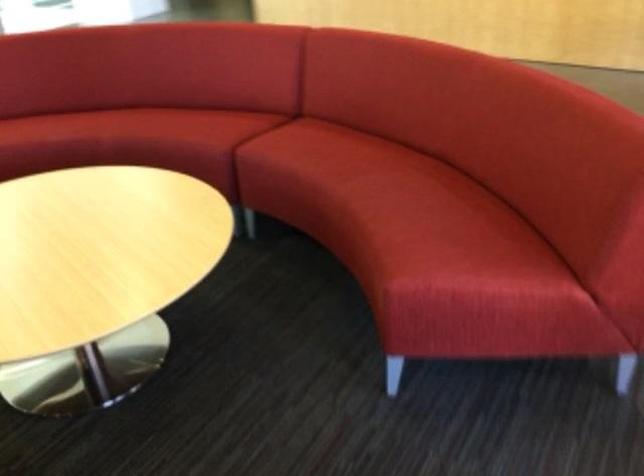
Find where to sit the red sofa sitting surface. Please return your answer as a coordinate pair (x, y).

(370, 186)